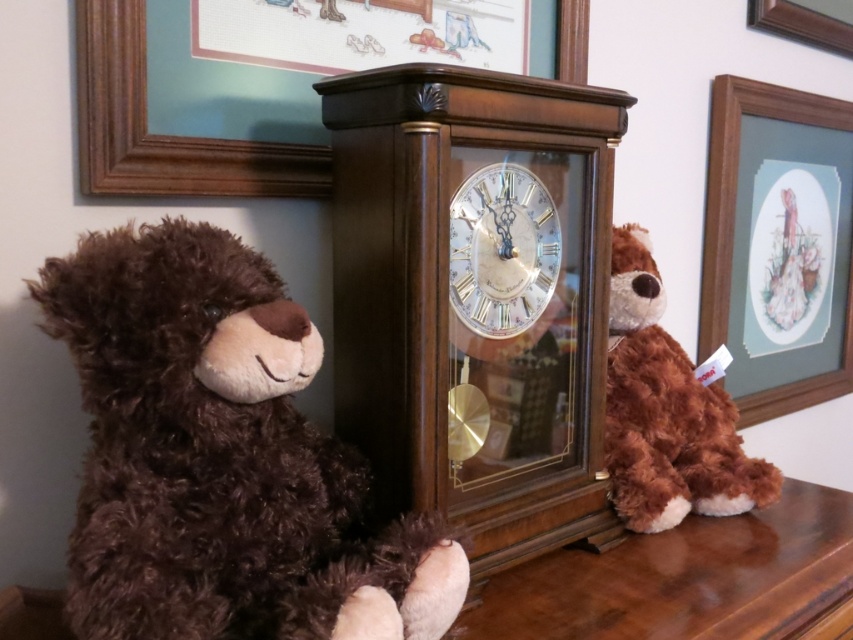
You are standing in front of the grandfather clock and want to place a small vase between the brown plush toy at right and the clock. Can you determine if there is enough space between them to place the vase?

The brown plush toy at right is located at point (666, 412), so there is enough space between the brown plush toy at right and the clock to place the vase.

You are an interior designer planning to hang a new picture frame in this room. You notice the matte wood picture frame at upper right and the wooden picture frame at upper right. Can you determine if there is enough space between them to hang another frame of 10 inches in width?

The matte wood picture frame at upper right and wooden picture frame at upper right are 10.29 inches apart from each other. Since the space between them is 10.29 inches, which is slightly larger than the 10 inches width of the new frame, there is enough space to hang the new frame between them.

You are an interior designer arranging items in a living room. You notice two wooden picture frames at the upper right corner of the wall. The first is a matte wood picture frame at upper right and the second is a wooden picture frame at upper right. Which one is positioned lower on the wall?

The matte wood picture frame at upper right is positioned lower than the wooden picture frame at upper right because it is described as being below the wooden picture frame at upper right.